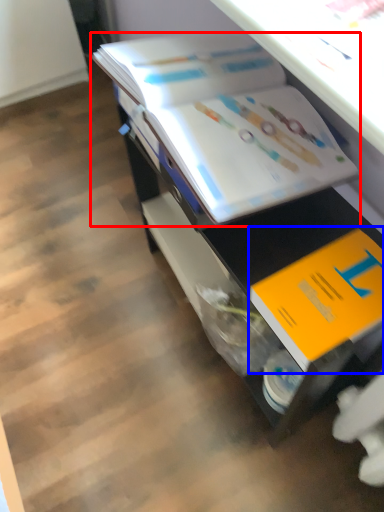
Question: Among these objects, which one is farthest to the camera, book (highlighted by a red box) or book (highlighted by a blue box)?

Choices:
 (A) book
 (B) book

Answer: (A)